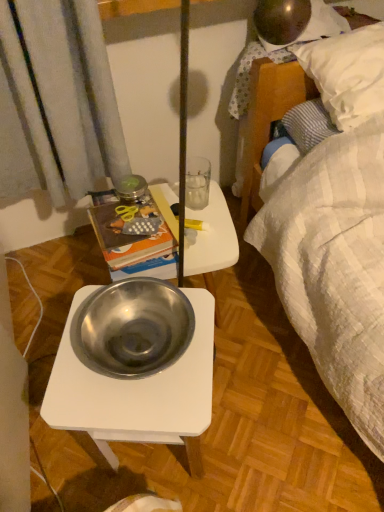
Locate an element on the screen. This screenshot has width=384, height=512. empty space that is ontop of metallic silver bowl at center (from a real-world perspective) is located at coordinates (197, 223).